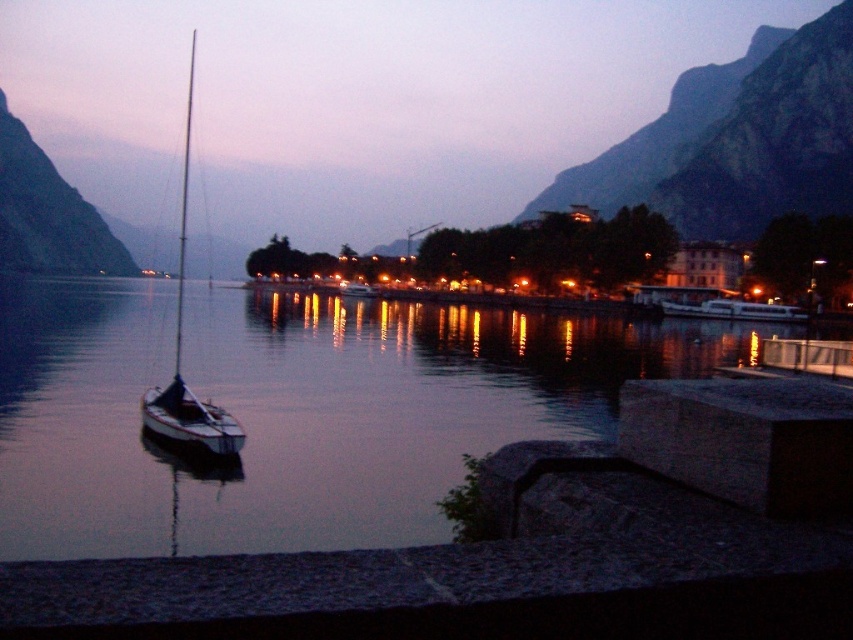
You are an outdoor enthusiast planning to take a photo of the smooth water at center and the green rock mountain at left. Which object would you focus on first if you want to capture both in a single frame without moving the camera?

The green rock mountain at left should be focused on first because it is larger in size compared to the smooth water at center, ensuring it fits well within the frame.

You are standing at the lakeside and want to take a photo of the rugged stone mountain at upper right. Based on its coordinates, where should you position yourself to ensure the mountain is centered in your camera frame?

Since the rugged stone mountain at upper right is located at point coordinates of 0.219 on the x axis and 0.866 on the y axis, you should position yourself slightly to the left side of the scene and closer to the lower part of the frame to center the mountain in your camera view.

You are standing at the point marked by the coordinates point (293,410). Looking around the serene lakeside scene during twilight, which object is directly in front of you?

The smooth water at center is directly in front of you at the coordinates point (293,410).